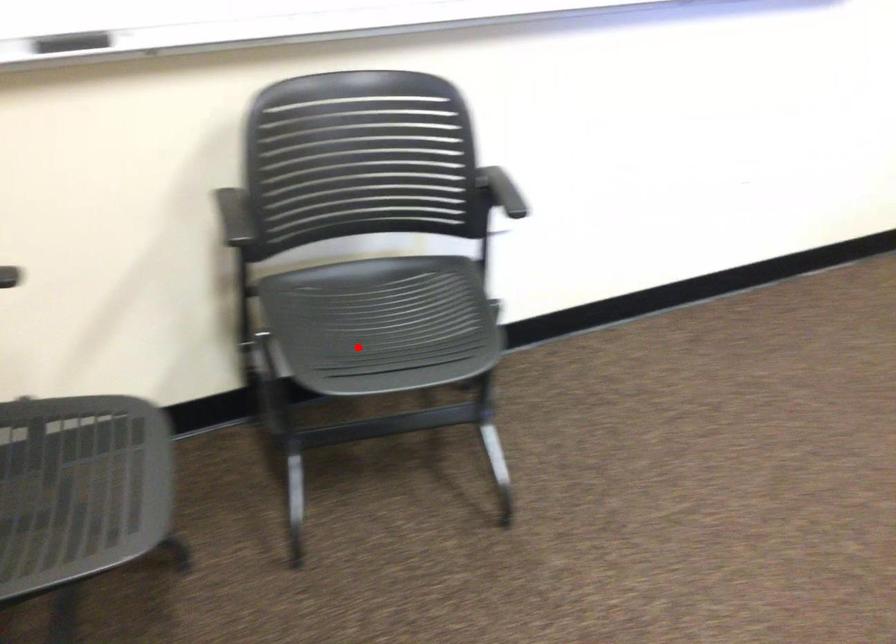
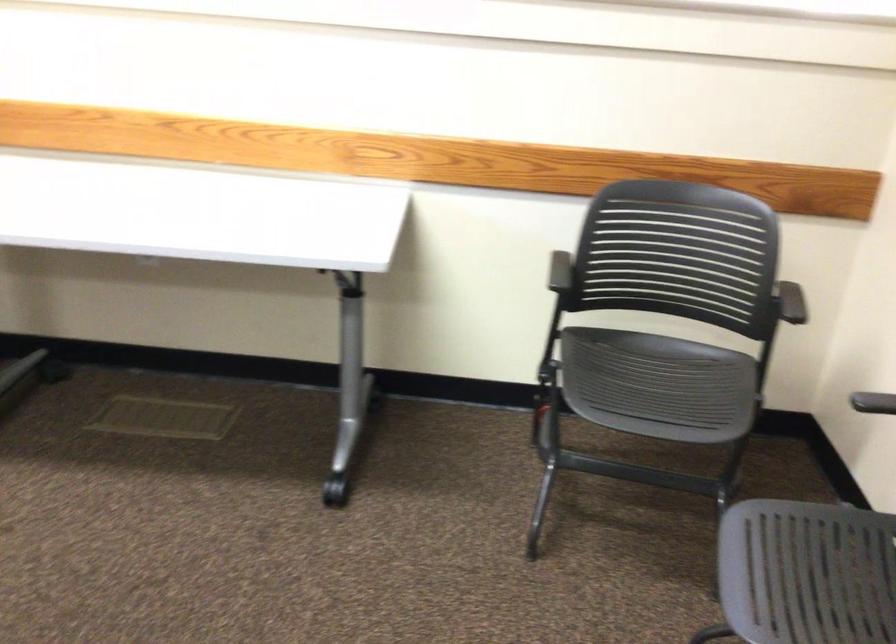
Question: A red point is marked in image1. In image2, is the corresponding 3D point closer to the camera or farther? Reply with the corresponding letter.

Choices:
 (A) The corresponding 3D point is closer.
 (B) The corresponding 3D point is farther.

Answer: (A)